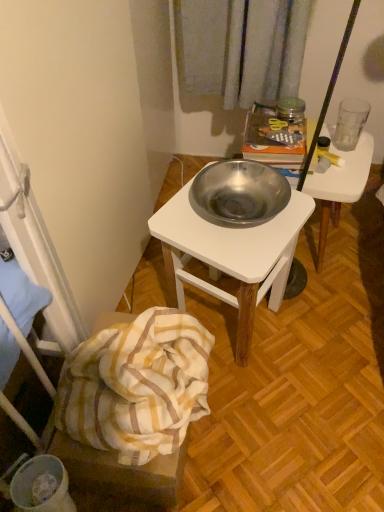
Find the location of a particular element. The width and height of the screenshot is (384, 512). vacant point to the right of white striped fabric at lower left is located at coordinates (258, 430).